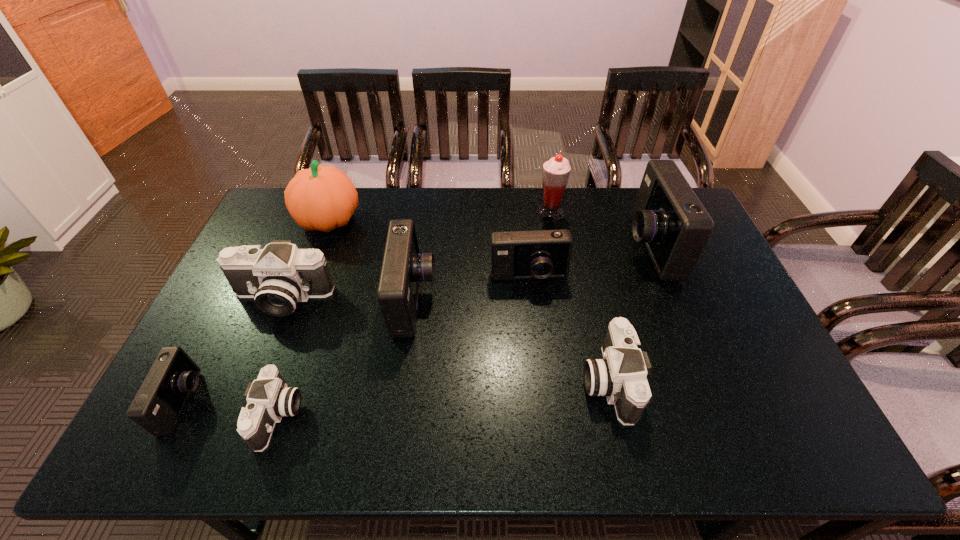
Find the location of a particular element. This screenshot has width=960, height=540. free point between the farthest black camera and the smallest blue camera is located at coordinates [232, 350].

Find the location of a particular element. The width and height of the screenshot is (960, 540). empty space that is in between the third blue camera from left to right and the second smallest black camera is located at coordinates (568, 329).

I want to click on object that stands as the seventh closest to the nearest blue camera, so (x=556, y=171).

Point out which object is positioned as the eighth nearest to the second blue camera from left to right. Please provide its 2D coordinates. Your answer should be formatted as a tuple, i.e. [(x, y)], where the tuple contains the x and y coordinates of a point satisfying the conditions above.

[(669, 218)]

Find the location of `camera that is the closest to the rightmost black camera`. camera that is the closest to the rightmost black camera is located at coordinates (538, 254).

Identify the location of camera that is the closest one to the fourth camera from right to left. The width and height of the screenshot is (960, 540). (538, 254).

Image resolution: width=960 pixels, height=540 pixels. What are the coordinates of `blue camera that is the third closest one to the third blue camera from left to right` in the screenshot? It's located at (159, 402).

The height and width of the screenshot is (540, 960). I want to click on the closest blue camera relative to the tallest camera, so click(538, 254).

The width and height of the screenshot is (960, 540). Identify the location of black camera that is the closest to the smallest black camera. (279, 276).

This screenshot has width=960, height=540. In order to click on black camera identified as the closest to the red smoothie in this screenshot , I will do `click(621, 376)`.